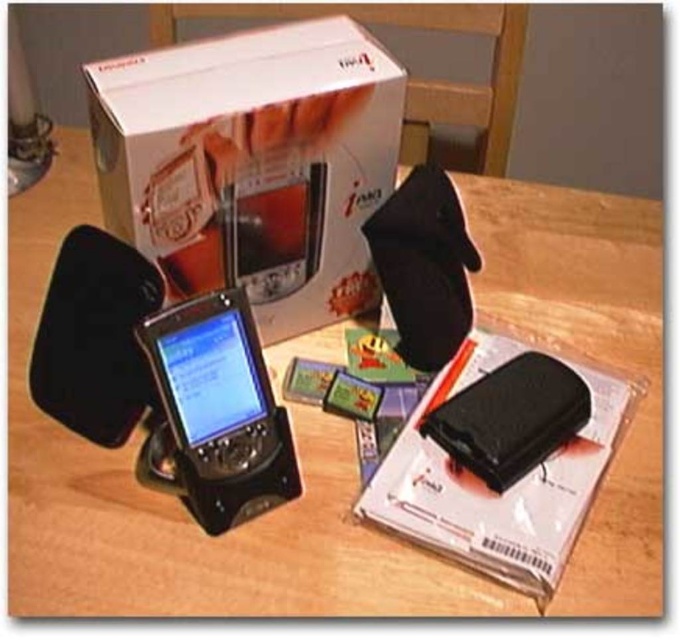
Question: Which point appears farthest from the camera in this image?

Choices:
 (A) (250, 346)
 (B) (290, 116)

Answer: (B)

Question: Which of the following is the closest to the observer?

Choices:
 (A) white cardboard box at upper center
 (B) matte black smartphone at center

Answer: (A)

Question: Which of the following is the farthest from the observer?

Choices:
 (A) (273, 29)
 (B) (273, 461)

Answer: (A)

Question: Is white cardboard box at upper center closer to camera compared to matte black smartphone at center?

Choices:
 (A) yes
 (B) no

Answer: (A)

Question: Does white cardboard box at upper center appear on the right side of matte black smartphone at center?

Choices:
 (A) yes
 (B) no

Answer: (A)

Question: Is white cardboard box at upper center behind matte black smartphone at center?

Choices:
 (A) no
 (B) yes

Answer: (A)